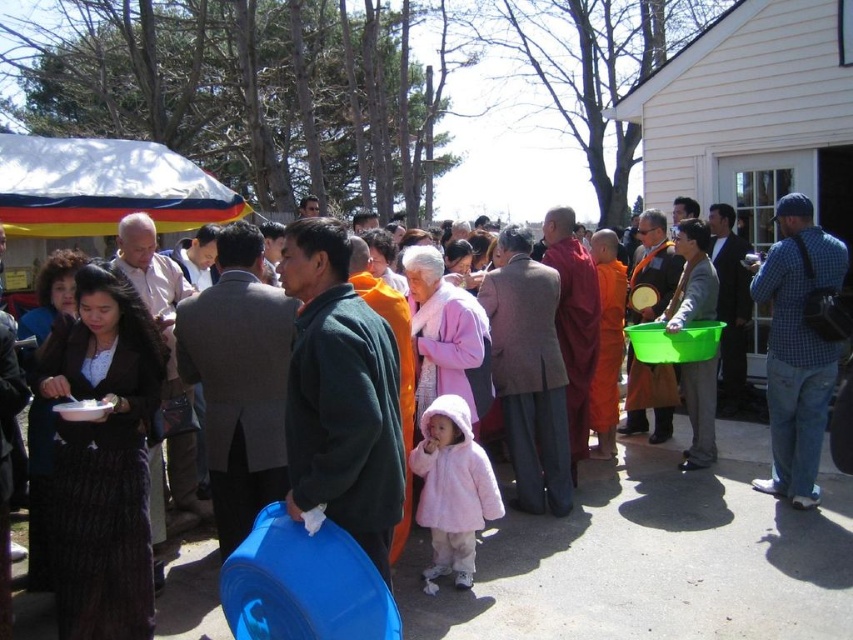
You are standing at the center of the gathering and notice a point marked at coordinates (x=529, y=380). Which object from the scene does this point lie on?

The point at coordinates (x=529, y=380) lies on the orange cotton robe at center.

You are at a community event and see two people wearing robes. One is wearing an orange cotton robe at center and the other a maroon silk robe at center. Which robe is located to the left when looking at both robes?

The orange cotton robe at center is positioned on the left side of the maroon silk robe at center, so the orange cotton robe at center is located to the left.